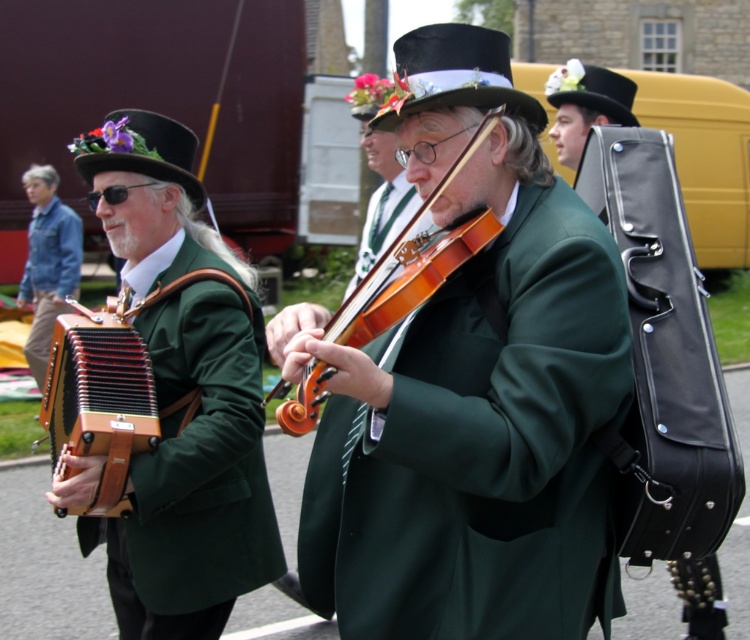
Question: Can you confirm if matte green coat at center is thinner than denim jacket at left?

Choices:
 (A) yes
 (B) no

Answer: (B)

Question: Can you confirm if black felt top hat at center is bigger than black felt top hat at upper center?

Choices:
 (A) no
 (B) yes

Answer: (B)

Question: Is wooden violin at center above black felt top hat at center?

Choices:
 (A) yes
 (B) no

Answer: (B)

Question: Among these objects, which one is nearest to the camera?

Choices:
 (A) wooden violin at center
 (B) black felt top hat at center
 (C) wooden accordion at left

Answer: (A)

Question: Among these points, which one is nearest to the camera?

Choices:
 (A) (x=292, y=422)
 (B) (x=506, y=278)
 (C) (x=84, y=349)

Answer: (A)

Question: Among these objects, which one is farthest from the camera?

Choices:
 (A) purple felt hat at left
 (B) matte green accordion at left
 (C) wooden violin at center

Answer: (A)